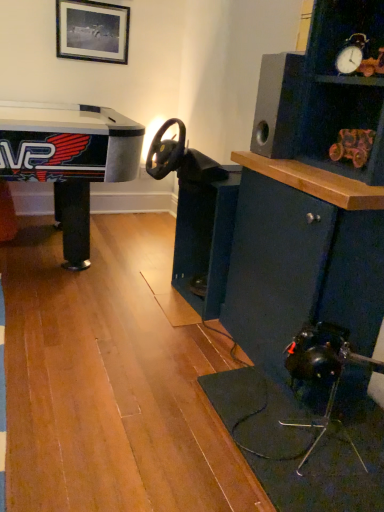
Question: In the image, is dark blue wood cabinet at center positioned in front of or behind black matte speaker at upper right?

Choices:
 (A) behind
 (B) front

Answer: (A)

Question: In terms of height, does dark blue wood cabinet at center look taller or shorter compared to black matte speaker at upper right?

Choices:
 (A) short
 (B) tall

Answer: (B)

Question: Estimate the real-world distances between objects in this image. Which object is farther from the wooden toy car at upper right?

Choices:
 (A) black matte speaker at upper right
 (B) black matte picture frame at upper center
 (C) dark blue wood cabinet at center

Answer: (B)

Question: Considering the real-world distances, which object is closest to the wooden toy car at upper right?

Choices:
 (A) black matte picture frame at upper center
 (B) black matte speaker at upper right
 (C) dark blue wood cabinet at center

Answer: (B)